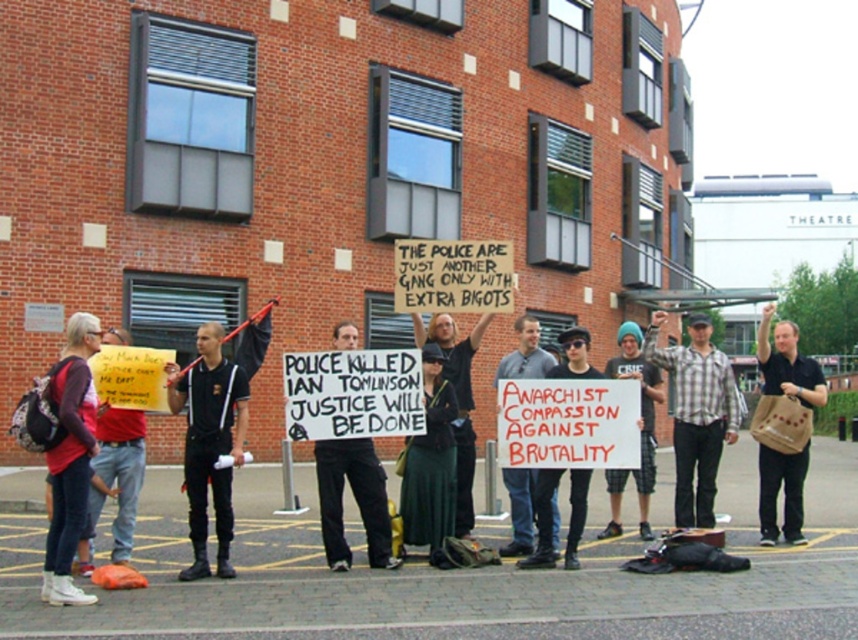
What is located at the coordinates point (209, 442)?

The black matte shirt at center is located at point (209, 442).

You are a photographer at the protest scene. You want to capture a photo that includes both the black matte shirt at center and the white paper sign at center. Which object should you focus on first to ensure both are in frame?

The black matte shirt at center is located below the white paper sign at center, so you should focus on the white paper sign at center first to ensure both are in frame.

You are a photographer trying to capture a detailed shot of the black matte shirt at center and the black cotton pants at center. Which one should you focus on first if you want to ensure both are in frame without moving the camera?

The black matte shirt at center is positioned on the left side of black cotton pants at center, so you should focus on the black cotton pants at center first to ensure both are in frame without moving the camera.